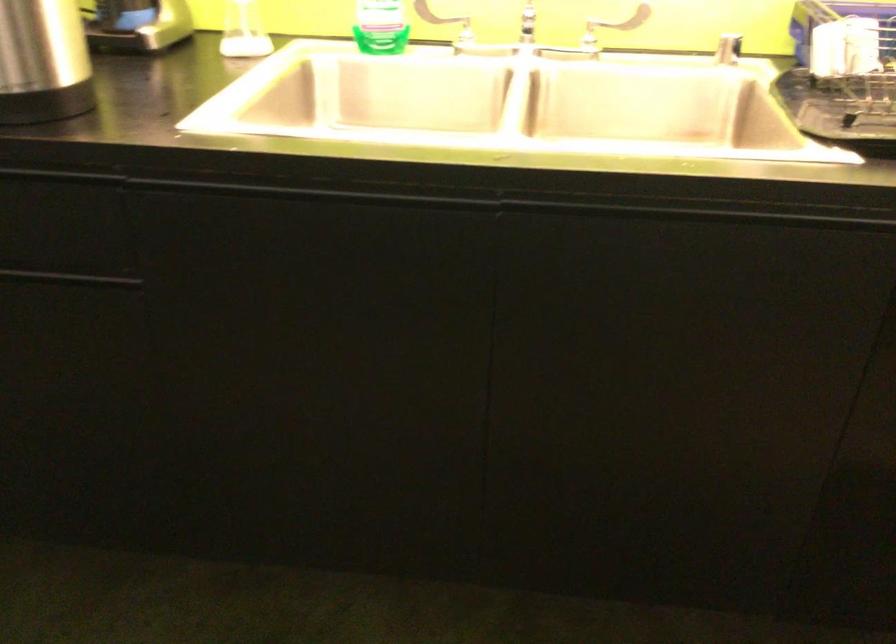
Find the location of `black cabinet handle`. black cabinet handle is located at coordinates (71, 279).